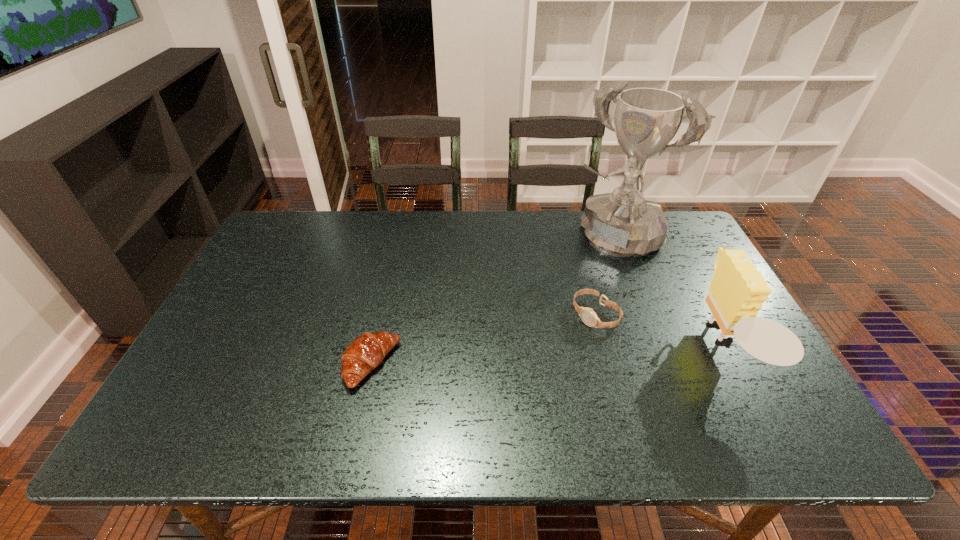
Identify the location of vacant space located 0.250m on the face of the watch. (511, 377).

Locate an element on the screen. This screenshot has width=960, height=540. vacant space located on the face of the watch is located at coordinates (475, 403).

Where is `object located in the far edge section of the desktop`? Image resolution: width=960 pixels, height=540 pixels. object located in the far edge section of the desktop is located at coordinates (623, 224).

I want to click on crescent roll situated at the near edge, so click(x=366, y=352).

The width and height of the screenshot is (960, 540). Find the location of `sponge that is at the near edge`. sponge that is at the near edge is located at coordinates [x=736, y=294].

I want to click on sponge that is positioned at the right edge, so click(736, 294).

Locate an element on the screen. award located at the right edge is located at coordinates coord(623,224).

This screenshot has width=960, height=540. Find the location of `object located at the far right corner`. object located at the far right corner is located at coordinates (623, 224).

Identify the location of object located at the near right corner. Image resolution: width=960 pixels, height=540 pixels. coord(736,294).

Identify the location of free space at the far edge. (393, 228).